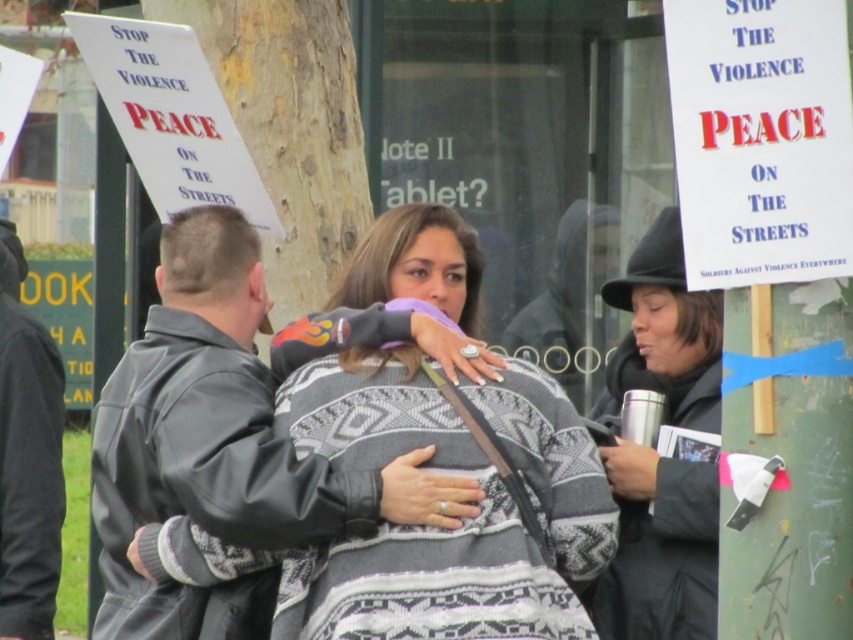
You are a photographer standing at the edge of the protest area. You want to take a photo that includes both the leather jacket at center and the black woolen hat at upper right. Given that your camera has a maximum focus range of 2 meters, will you be able to capture both subjects in focus?

The distance between the leather jacket at center and the black woolen hat at upper right is 2.03 meters. Since the camera can only focus within 2 meters, the subjects are slightly out of the focus range. Therefore, you might not be able to capture both in focus simultaneously.